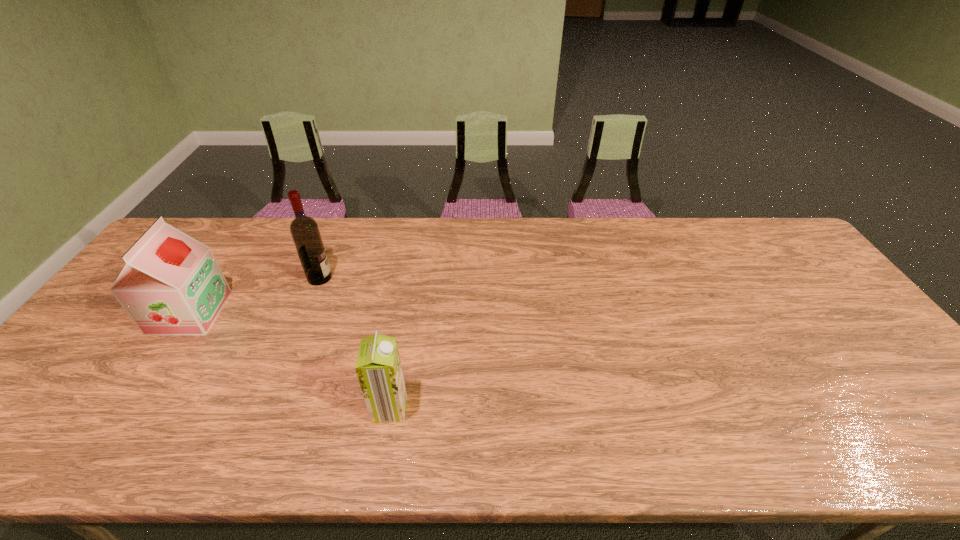
Locate an element on the screen. The image size is (960, 540). object located in the left edge section of the desktop is located at coordinates (171, 284).

The width and height of the screenshot is (960, 540). In the image, there is a desktop. What are the coordinates of `free region at the far edge` in the screenshot? It's located at (432, 227).

This screenshot has height=540, width=960. Find the location of `blank space at the near edge of the desktop`. blank space at the near edge of the desktop is located at coordinates (832, 435).

I want to click on vacant space at the left edge of the desktop, so click(96, 337).

The image size is (960, 540). I want to click on free location at the right edge, so click(x=863, y=348).

What are the coordinates of `vacant space at the far left corner` in the screenshot? It's located at (203, 225).

You are a GUI agent. You are given a task and a screenshot of the screen. Output one action in this format:
    pyautogui.click(x=<x>, y=<y>)
    Task: Click on the free space between the leftmost object and the farthest object
    This screenshot has width=960, height=540.
    Given the screenshot: What is the action you would take?
    tap(254, 295)

Where is `vacant space that is in between the taller soya milk and the alcohol`? The width and height of the screenshot is (960, 540). vacant space that is in between the taller soya milk and the alcohol is located at coordinates (254, 295).

This screenshot has height=540, width=960. I want to click on free space between the farthest object and the farther soya milk, so click(x=254, y=295).

Where is `free area in between the second object from right to left and the taller soya milk`? The width and height of the screenshot is (960, 540). free area in between the second object from right to left and the taller soya milk is located at coordinates (254, 295).